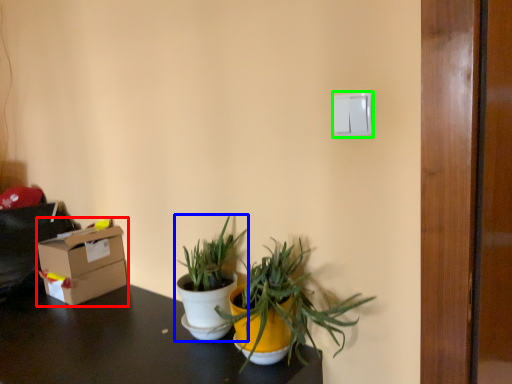
Question: Which is nearer to the box (highlighted by a red box)? houseplant (highlighted by a blue box) or light switch (highlighted by a green box).

Choices:
 (A) houseplant
 (B) light switch

Answer: (A)